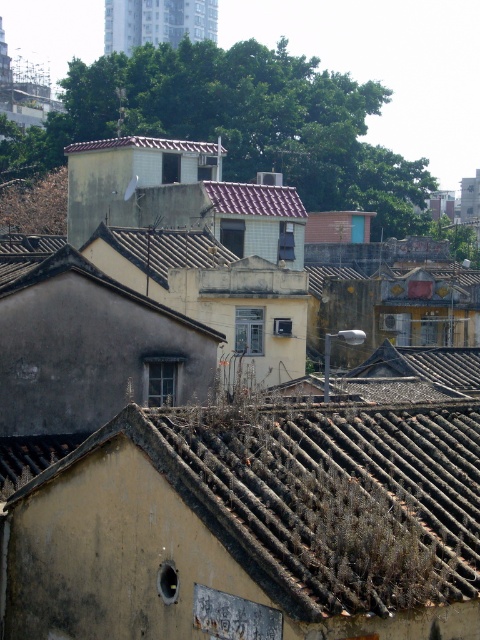
Question: Considering the relative positions of brown textured tile roof at lower center and brown tile roof at upper center in the image provided, where is brown textured tile roof at lower center located with respect to brown tile roof at upper center?

Choices:
 (A) below
 (B) above

Answer: (A)

Question: Can you confirm if brown textured tile roof at lower center is positioned below brown tile roof at upper center?

Choices:
 (A) yes
 (B) no

Answer: (A)

Question: Which point is closer to the camera?

Choices:
 (A) click(220, 410)
 (B) click(199, 150)

Answer: (A)

Question: Does brown textured tile roof at lower center appear on the right side of brown tile roof at upper center?

Choices:
 (A) no
 (B) yes

Answer: (B)